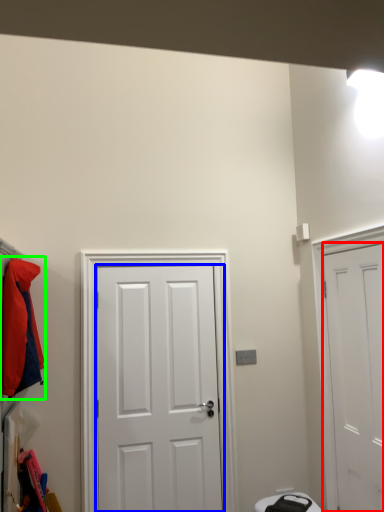
Question: Considering the real-world distances, which object is farthest from door (highlighted by a red box)? door (highlighted by a blue box) or jacket (highlighted by a green box)?

Choices:
 (A) door
 (B) jacket

Answer: (B)